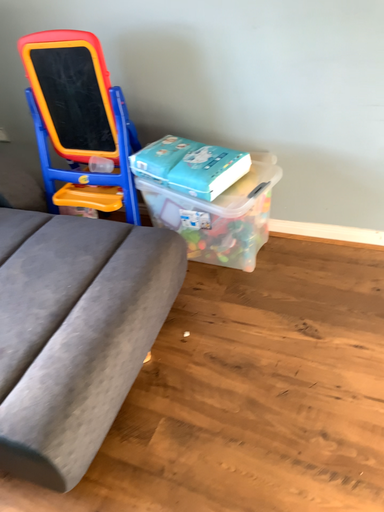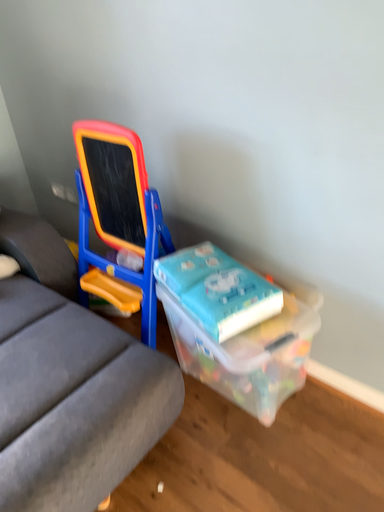
Question: Which way did the camera rotate in the video?

Choices:
 (A) rotated left
 (B) rotated right

Answer: (A)